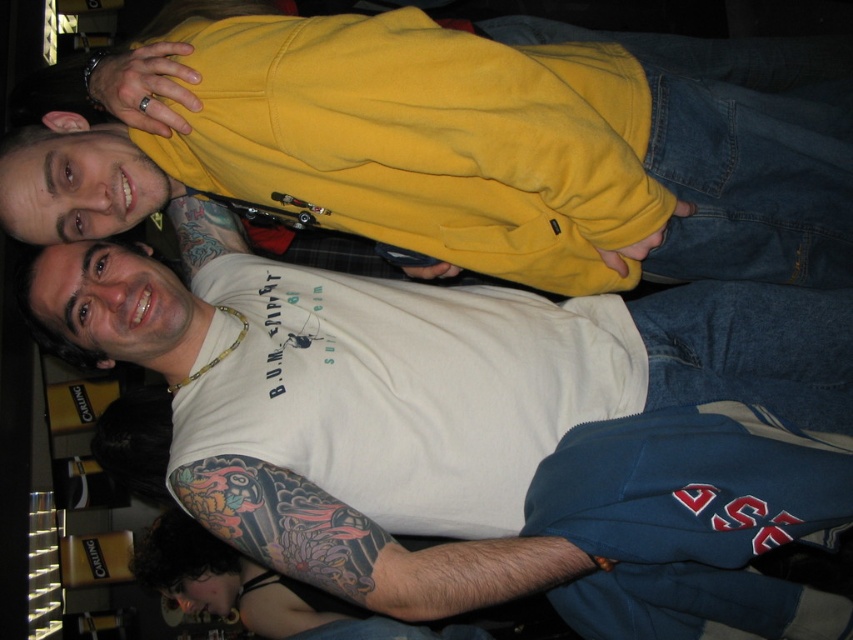
Question: Can you confirm if yellow matte sweatshirt at upper center is positioned to the right of white matte t-shirt at center?

Choices:
 (A) yes
 (B) no

Answer: (A)

Question: Which object is farther from the camera taking this photo?

Choices:
 (A) yellow matte sweatshirt at upper center
 (B) white matte t-shirt at center
 (C) colored tattooed arm at lower left

Answer: (B)

Question: Is yellow matte sweatshirt at upper center to the right of white matte t-shirt at center from the viewer's perspective?

Choices:
 (A) yes
 (B) no

Answer: (A)

Question: From the image, what is the correct spatial relationship of white matte t-shirt at center in relation to colored tattooed arm at lower left?

Choices:
 (A) below
 (B) above

Answer: (B)

Question: Which object is the farthest from the white matte t-shirt at center?

Choices:
 (A) colored tattooed arm at lower left
 (B) yellow matte sweatshirt at upper center

Answer: (B)

Question: Which object is farther from the camera taking this photo?

Choices:
 (A) white matte t-shirt at center
 (B) yellow matte sweatshirt at upper center
 (C) colored tattooed arm at lower left

Answer: (A)